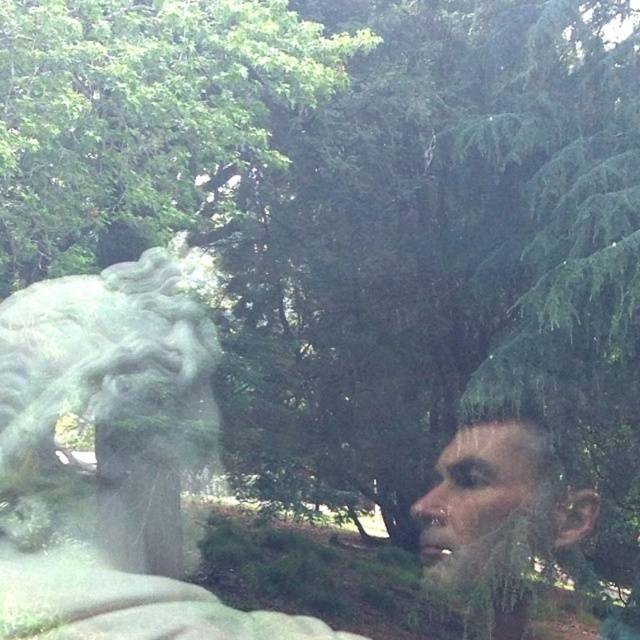
Can you confirm if green leafy tree at upper center is shorter than smooth skin face at center?

No.

Which is in front, point (104, 115) or point (481, 477)?

Positioned in front is point (104, 115).

Does point (122, 92) come behind point (497, 572)?

No, it is not.

I want to click on green leafy tree at upper center, so click(140, 113).

Does point (196, 77) lie in front of point (108, 387)?

Yes.

Does green leafy tree at upper center appear under gray stone lion at left?

Incorrect, green leafy tree at upper center is not positioned below gray stone lion at left.

Locate an element on the screen. Image resolution: width=640 pixels, height=640 pixels. green leafy tree at upper center is located at coordinates (140, 113).

Looking at this image, who is higher up, gray stone lion at left or smooth skin face at center?

gray stone lion at left is higher up.

Is gray stone lion at left further to the viewer compared to smooth skin face at center?

Result: No.

Between point (42, 493) and point (426, 536), which one is positioned in front?

Point (42, 493) is in front.

Where is `gray stone lion at left`? The image size is (640, 640). gray stone lion at left is located at coordinates (108, 408).